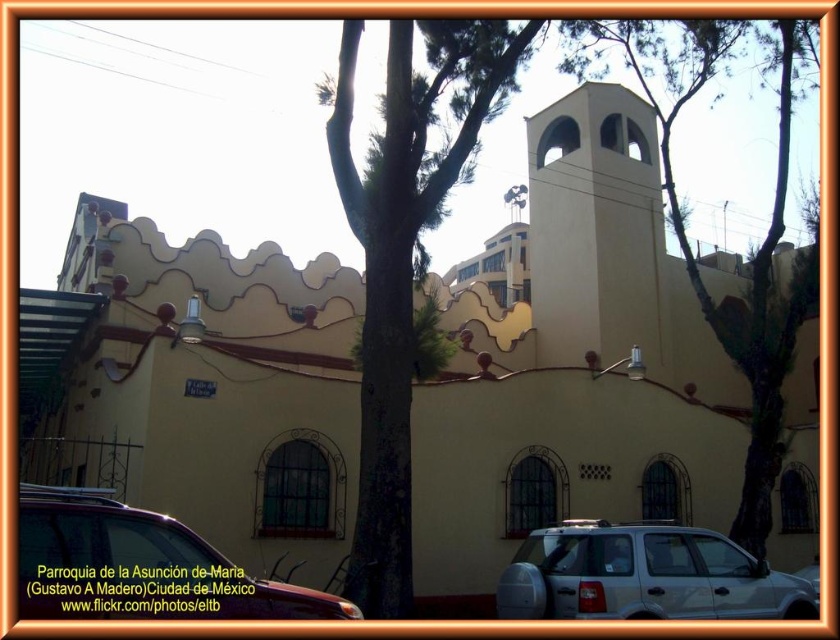
Is the position of green leafy tree at upper center less distant than that of metallic silver suv at lower left?

No, it is not.

What do you see at coordinates (767, 227) in the screenshot?
I see `green leafy tree at upper center` at bounding box center [767, 227].

This screenshot has height=640, width=840. In order to click on green leafy tree at upper center in this screenshot , I will do `click(767, 227)`.

What do you see at coordinates (405, 252) in the screenshot? The image size is (840, 640). I see `green leafy tree at center` at bounding box center [405, 252].

Does green leafy tree at center appear on the right side of metallic silver suv at lower left?

Yes, green leafy tree at center is to the right of metallic silver suv at lower left.

Where is `green leafy tree at center`? green leafy tree at center is located at coordinates (405, 252).

Where is `green leafy tree at center`? The width and height of the screenshot is (840, 640). green leafy tree at center is located at coordinates (405, 252).

The width and height of the screenshot is (840, 640). Find the location of `green leafy tree at upper center`. green leafy tree at upper center is located at coordinates (767, 227).

Is green leafy tree at upper center taller than silver metallic suv at lower center?

Yes.

Is point (764, 467) farther from viewer compared to point (735, 547)?

Yes, it is behind point (735, 547).

The width and height of the screenshot is (840, 640). I want to click on green leafy tree at upper center, so click(767, 227).